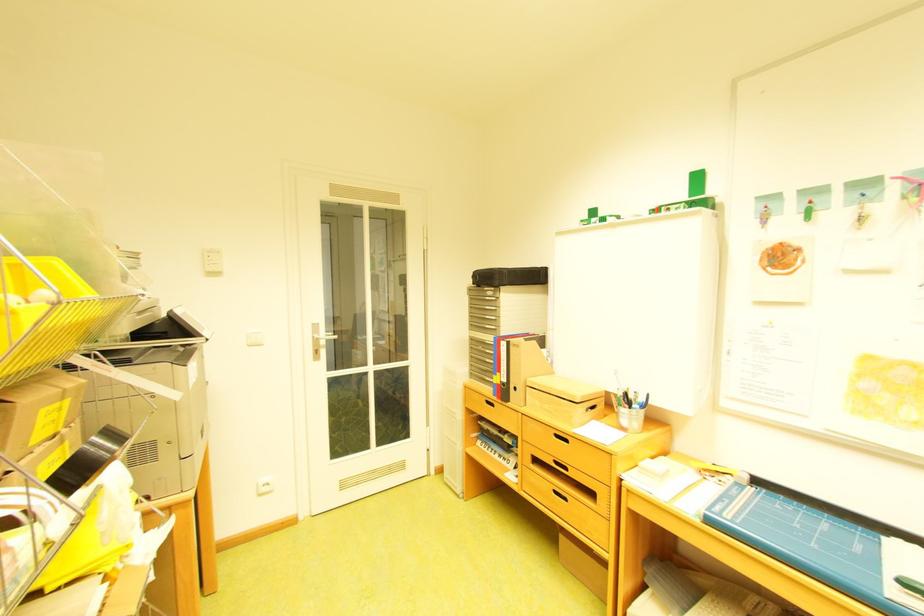
Where would you lift the wooden box lid? Please return your answer as a coordinate pair (x, y).

(565, 399)